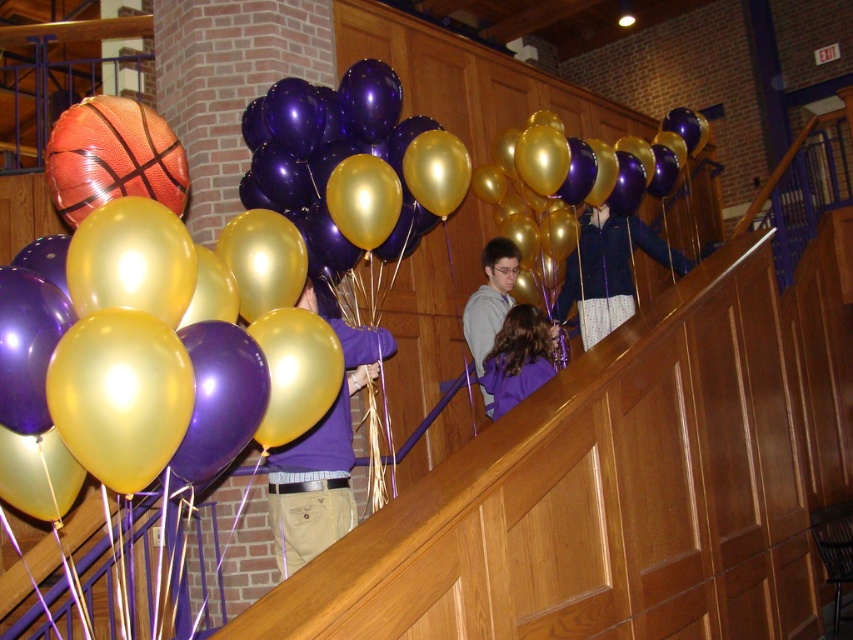
Between point (395, 100) and point (627, 282), which one is positioned in front?

Point (395, 100) is more forward.

From the picture: Between metallic gold balloon at center and dark blue jacket at upper right, which one appears on the right side from the viewer's perspective?

From the viewer's perspective, dark blue jacket at upper right appears more on the right side.

Who is more forward, (293, 172) or (555, 317)?

Point (293, 172) is more forward.

Locate an element on the screen. The height and width of the screenshot is (640, 853). metallic gold balloon at center is located at coordinates (335, 163).

Is metallic gold balloon at center smaller than purple matte shirt at center?

Incorrect, metallic gold balloon at center is not smaller in size than purple matte shirt at center.

From the picture: Is metallic gold balloon at center wider than purple matte shirt at center?

Indeed, metallic gold balloon at center has a greater width compared to purple matte shirt at center.

Is point (300, 237) closer to viewer compared to point (358, 385)?

Yes, it is in front of point (358, 385).

Where is `metallic gold balloon at center`? Image resolution: width=853 pixels, height=640 pixels. metallic gold balloon at center is located at coordinates (335, 163).

Between purple matte shirt at center and dark blue jacket at upper right, which one is positioned higher?

dark blue jacket at upper right is above.

Can you confirm if purple matte shirt at center is smaller than dark blue jacket at upper right?

Indeed, purple matte shirt at center has a smaller size compared to dark blue jacket at upper right.

Locate an element on the screen. purple matte shirt at center is located at coordinates (322, 460).

Locate an element on the screen. purple matte shirt at center is located at coordinates (x=322, y=460).